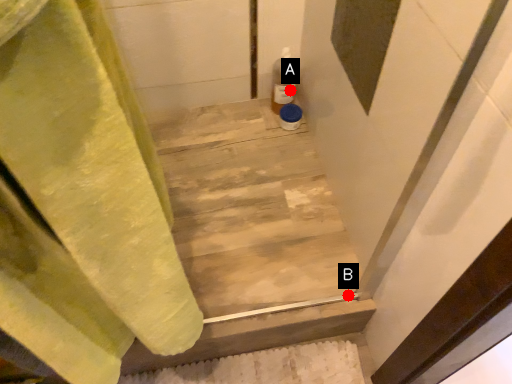
Question: Two points are circled on the image, labeled by A and B beside each circle. Which of the following is the closest to the observer?

Choices:
 (A) A is closer
 (B) B is closer

Answer: (B)